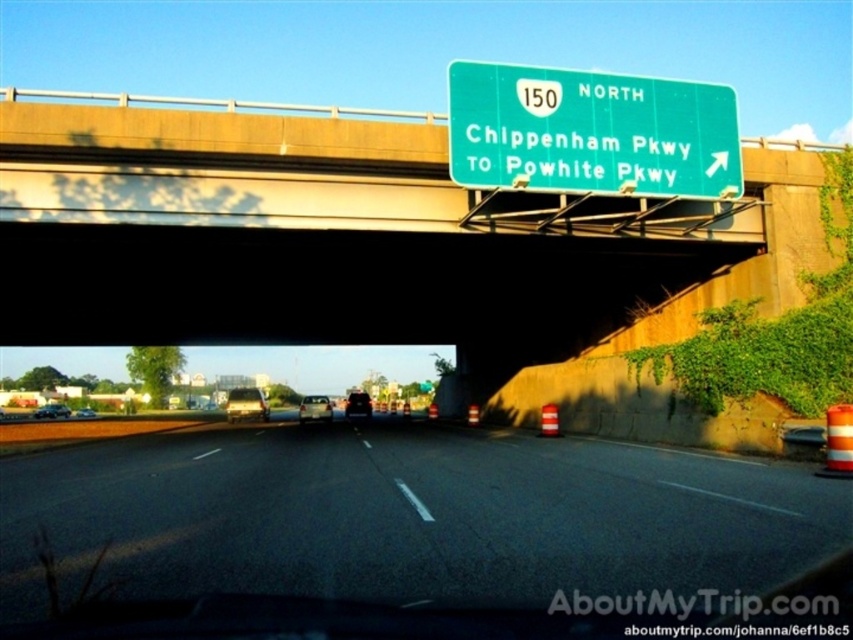
Is green metallic sign at upper center smaller than shiny silver sedan at center?

Yes.

The height and width of the screenshot is (640, 853). What do you see at coordinates (590, 132) in the screenshot?
I see `green metallic sign at upper center` at bounding box center [590, 132].

Is point (500, 106) positioned in front of point (61, 410)?

Yes, point (500, 106) is in front of point (61, 410).

Locate an element on the screen. This screenshot has height=640, width=853. green metallic sign at upper center is located at coordinates (590, 132).

Is black asphalt highway at center positioned before metallic silver sedan at center?

That is True.

Does black asphalt highway at center have a smaller size compared to metallic silver sedan at center?

Yes, black asphalt highway at center is smaller than metallic silver sedan at center.

At what (x,y) coordinates should I click in order to perform the action: click on black asphalt highway at center. Please return your answer as a coordinate pair (x, y). Image resolution: width=853 pixels, height=640 pixels. Looking at the image, I should click on (x=409, y=516).

Which is behind, point (611, 188) or point (363, 413)?

The point (363, 413) is behind.

Who is positioned more to the left, green metallic sign at upper center or black matte car at center?

Positioned to the left is black matte car at center.

Which is behind, point (656, 150) or point (355, 403)?

Point (355, 403)

Locate an element on the screen. The image size is (853, 640). green metallic sign at upper center is located at coordinates (590, 132).